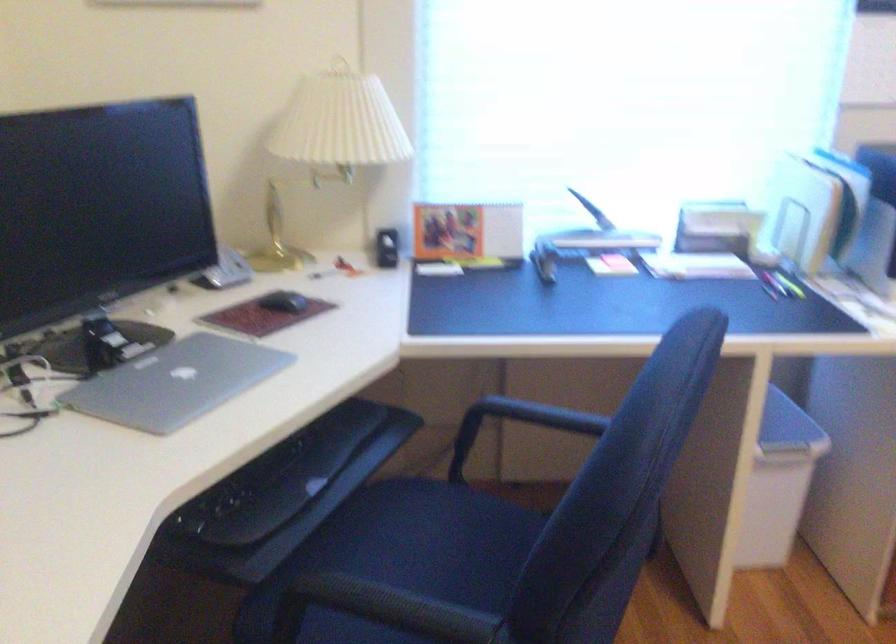
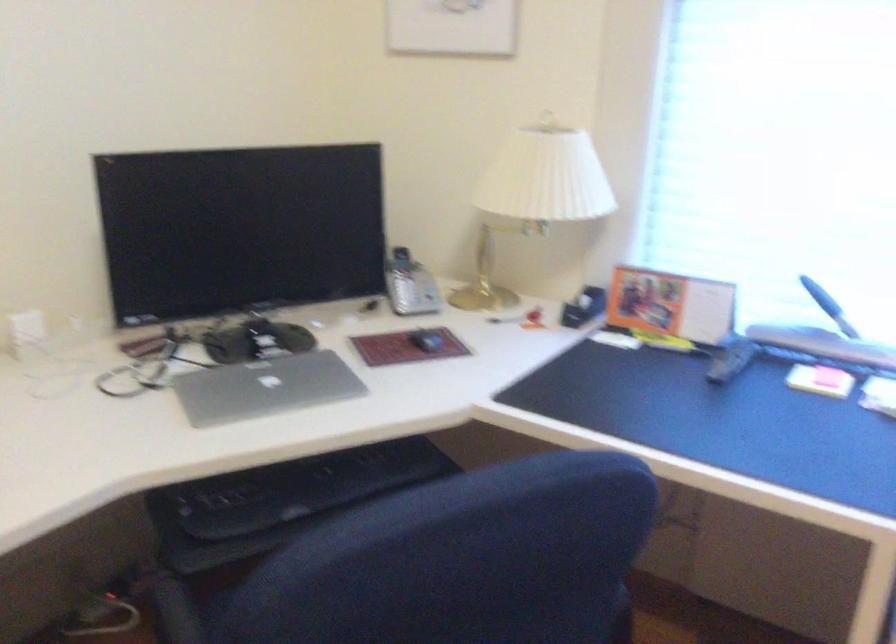
Find the pixel in the second image that matches [624,263] in the first image.

(829, 377)